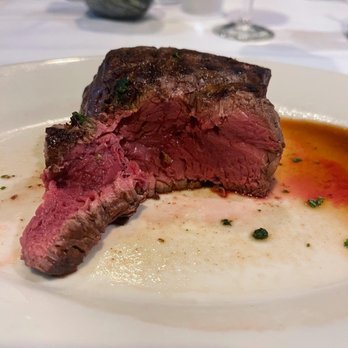
I want to click on rim of plate, so click(311, 66), click(65, 58), click(13, 63).